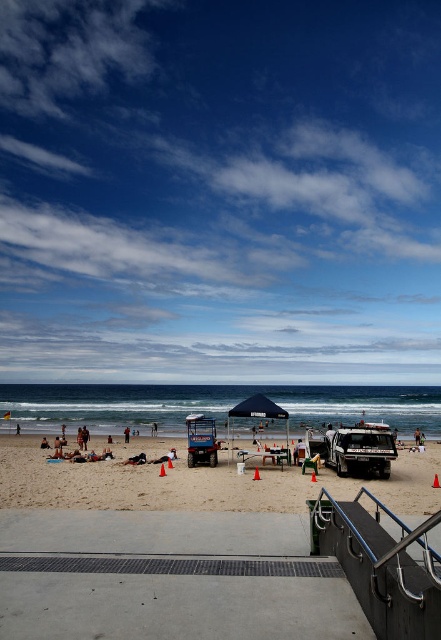
You are standing at the point with coordinates point [352,520] and want to walk towards the point [372,444]. Which direction should you move?

Since point [352,520] is in front of point [372,444], you should move backward to reach the point [372,444].

You are a photographer setting up equipment on the beach. You need to place a large tripod between the polished metal handrail at lower right and the metallic silver jeep at lower center. Which object should you position the tripod closer to to ensure it doesn

The polished metal handrail at lower right has a smaller size compared to the metallic silver jeep at lower center, so positioning the tripod closer to the handrail would provide more space between the tripod and the larger jeep.